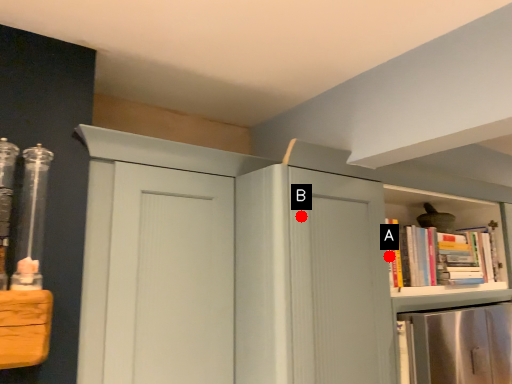
Question: Two points are circled on the image, labeled by A and B beside each circle. Which point is closer to the camera?

Choices:
 (A) A is closer
 (B) B is closer

Answer: (B)